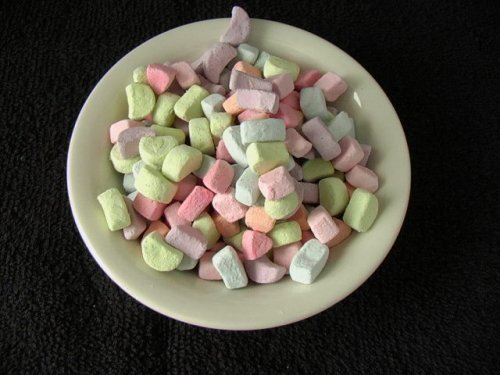
Find the location of a particular element. light spots in table is located at coordinates (25, 157), (29, 121), (39, 108), (40, 101), (30, 88).